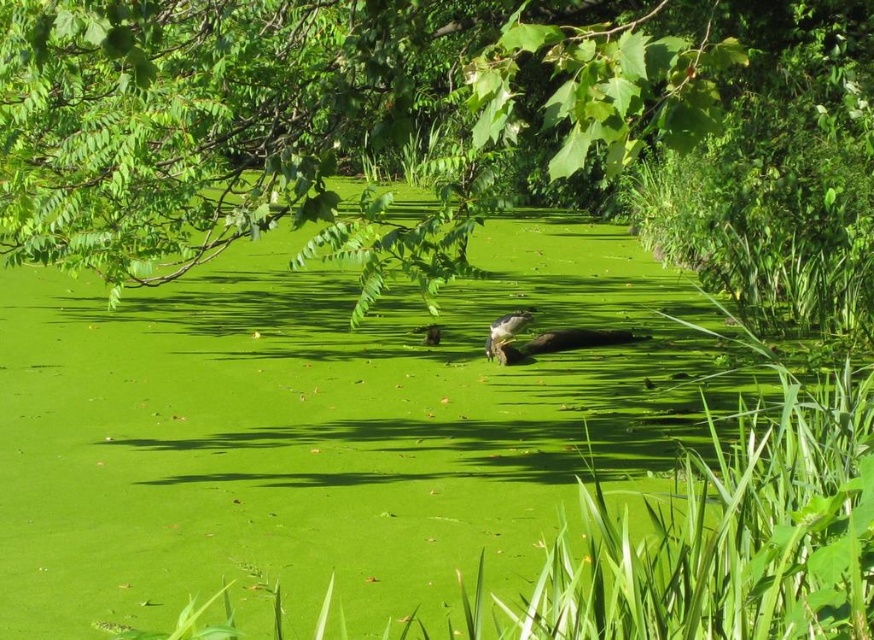
You are standing at the edge of the pond and want to locate the green leafy tree at center. According to the coordinates provided, where should you look relative to your position?

The green leafy tree at center is located at coordinates point (202, 131), which means it is positioned slightly to the left and lower than the center point of the image.

Based on the photo, you are observing a pond with a dark brown fur duck at center and a brown furry bird at center. Which one is taller?

The dark brown fur duck at center is taller than the brown furry bird at center.